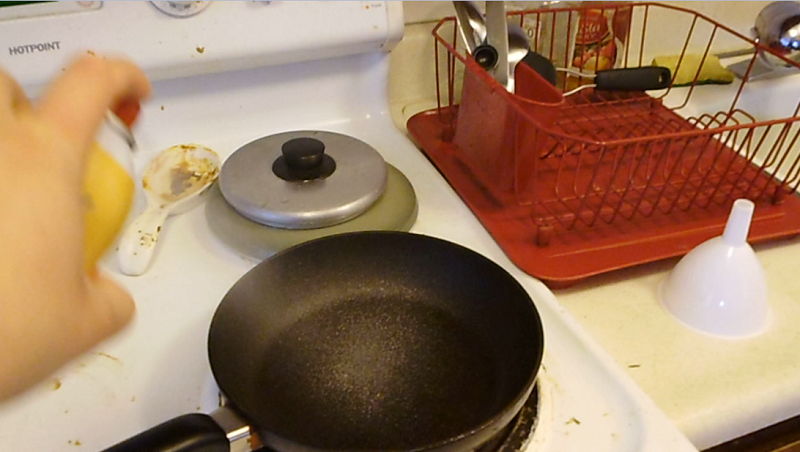
Locate an element on the screen. cooker is located at coordinates (208, 128).